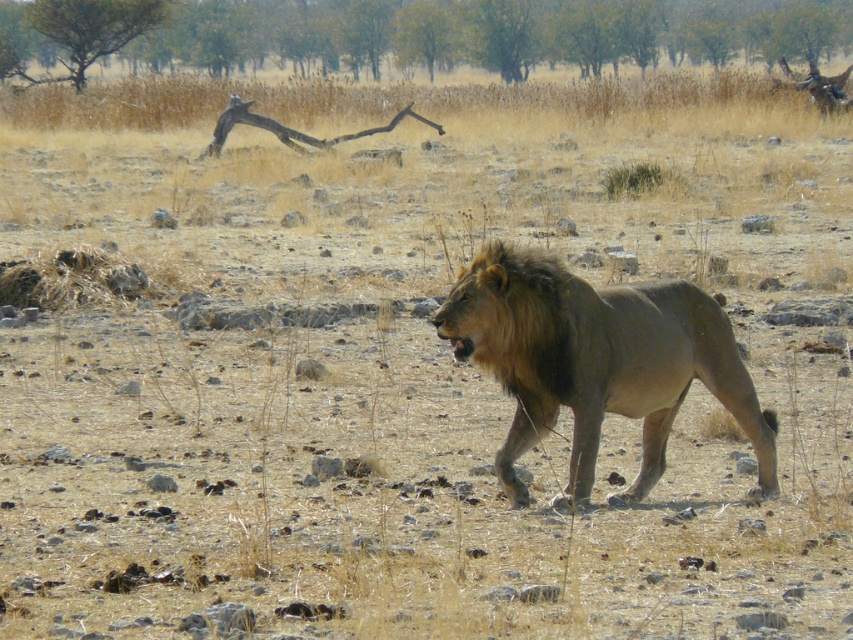
Question: Is green leafy tree at upper center positioned in front of green leafy tree at upper left?

Choices:
 (A) no
 (B) yes

Answer: (B)

Question: Among these points, which one is farthest from the camera?

Choices:
 (A) (573, 465)
 (B) (622, 44)

Answer: (B)

Question: Which object appears farthest from the camera in this image?

Choices:
 (A) green leafy tree at upper left
 (B) golden fur lion at center

Answer: (A)

Question: Based on their relative distances, which object is nearer to the green leafy tree at upper left?

Choices:
 (A) golden fur lion at center
 (B) green leafy tree at upper center

Answer: (B)

Question: Does green leafy tree at upper center have a smaller size compared to green leafy tree at upper left?

Choices:
 (A) no
 (B) yes

Answer: (A)

Question: Can you confirm if green leafy tree at upper center is smaller than golden fur lion at center?

Choices:
 (A) yes
 (B) no

Answer: (B)